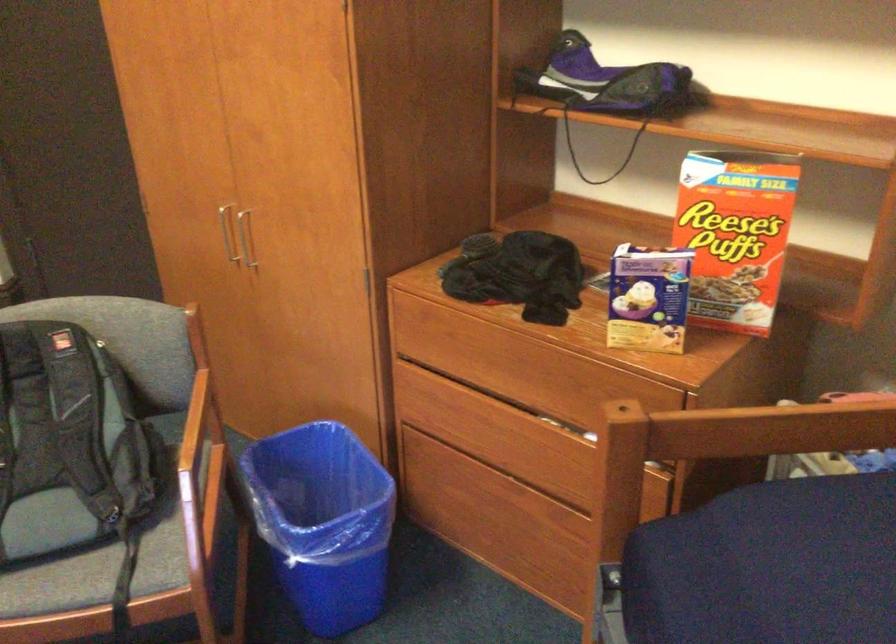
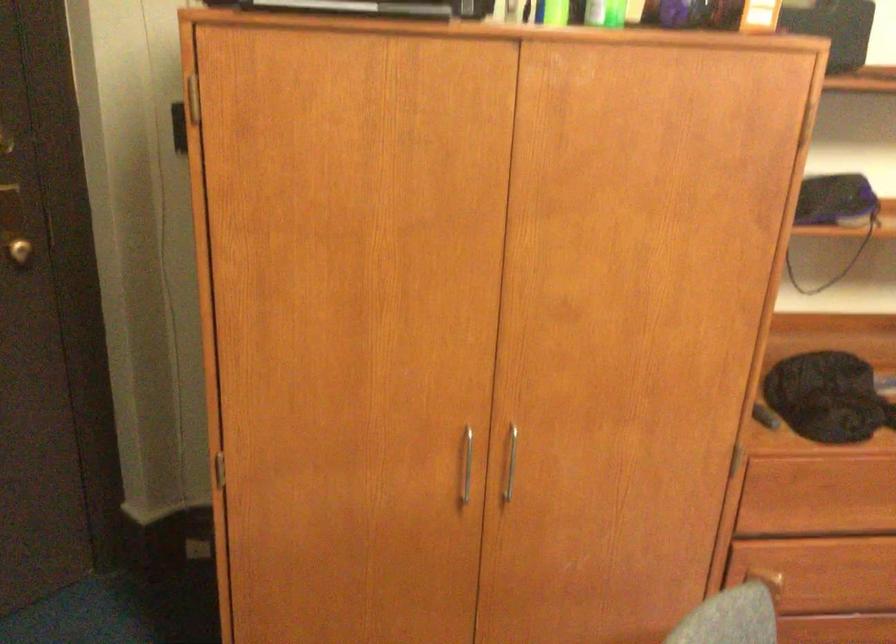
In the second image, find the point that corresponds to pixel 259 249 in the first image.

(511, 462)